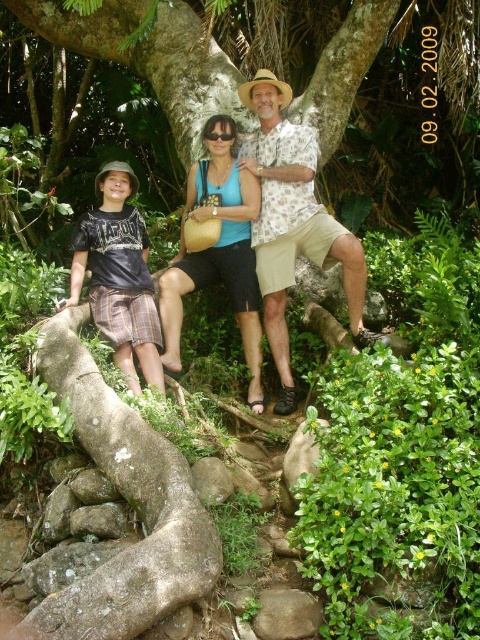
Does floral shirt at center have a lesser width compared to black matte goggles at center?

No.

Does floral shirt at center have a greater height compared to black matte goggles at center?

Yes.

Is point (269, 317) less distant than point (211, 134)?

That is True.

I want to click on floral shirt at center, so click(292, 221).

Does brown rough tree root at lower left appear under matte black shorts at center?

Yes.

Between brown rough tree root at lower left and matte black shorts at center, which one is positioned higher?

matte black shorts at center is above.

The height and width of the screenshot is (640, 480). Find the location of `brown rough tree root at lower left`. brown rough tree root at lower left is located at coordinates (130, 500).

Locate an element on the screen. The height and width of the screenshot is (640, 480). brown rough tree root at lower left is located at coordinates (130, 500).

Is point (288, 264) more distant than point (229, 131)?

No, (288, 264) is in front of (229, 131).

Is matte black shorts at center positioned at the back of black matte goggles at center?

No, it is not.

Locate an element on the screen. The width and height of the screenshot is (480, 640). matte black shorts at center is located at coordinates (x=292, y=221).